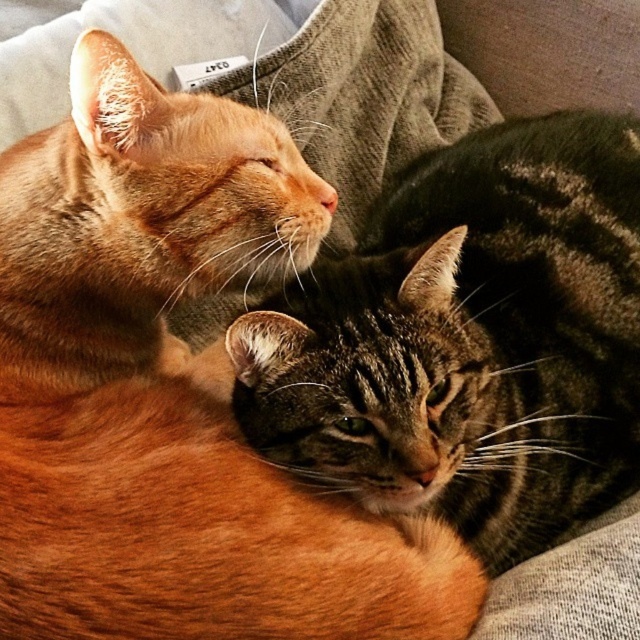
Question: Which point is closer to the camera?

Choices:
 (A) tabby fur cat at center
 (B) orange fur cat at upper left

Answer: (B)

Question: Is orange fur cat at upper left smaller than tabby fur cat at center?

Choices:
 (A) no
 (B) yes

Answer: (B)

Question: Among these points, which one is farthest from the camera?

Choices:
 (A) (579, 202)
 (B) (227, 627)

Answer: (A)

Question: Observing the image, what is the correct spatial positioning of orange fur cat at upper left in reference to tabby fur cat at center?

Choices:
 (A) below
 (B) above

Answer: (A)

Question: Is orange fur cat at upper left wider than tabby fur cat at center?

Choices:
 (A) no
 (B) yes

Answer: (A)